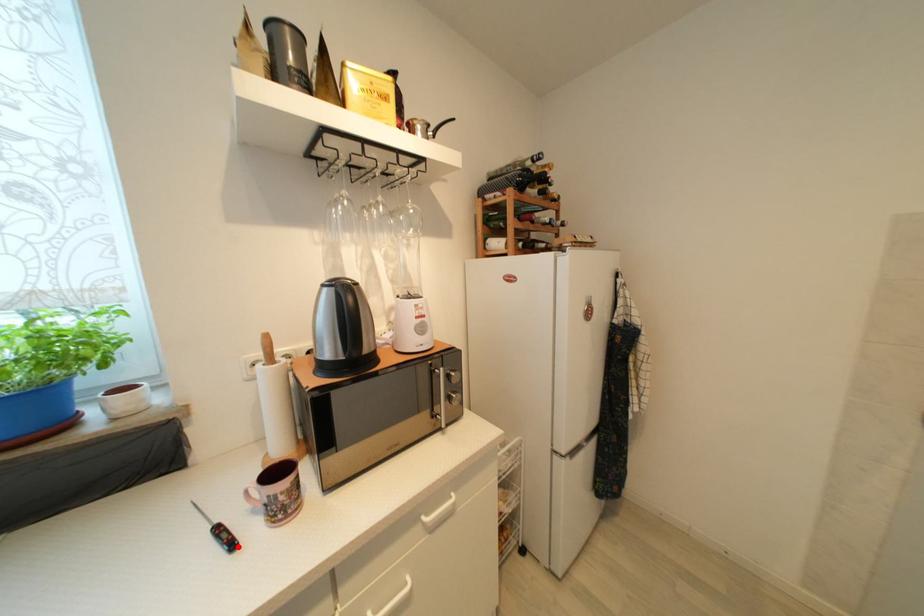
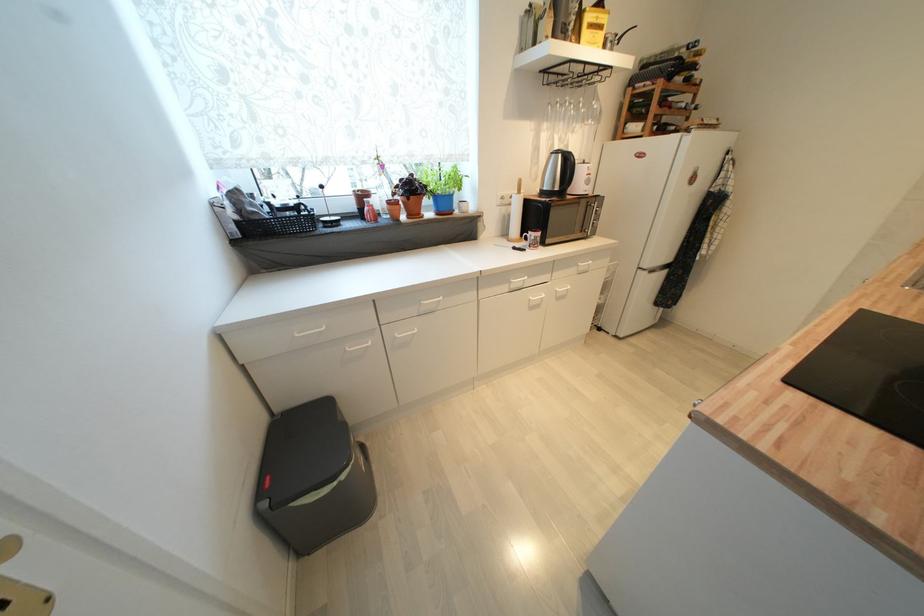
The point at the highlighted location is marked in the first image. Where is the corresponding point in the second image?

(529, 252)